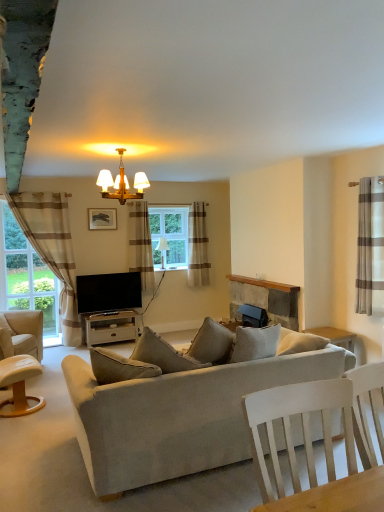
Question: From a real-world perspective, is rustic stone fireplace at center positioned above or below beige fabric couch at center?

Choices:
 (A) below
 (B) above

Answer: (B)

Question: Is rustic stone fireplace at center taller or shorter than beige fabric couch at center?

Choices:
 (A) tall
 (B) short

Answer: (B)

Question: Which is nearer to the clear glass window at center?

Choices:
 (A) matte gold chandelier at upper center, placed as the second lamp when sorted from bottom to top
 (B) rustic stone fireplace at center
 (C) beige striped curtain at left, which is the 4th curtain from right to left
 (D) light brown wooden chair at lower left, arranged as the 1th chair when viewed from the front
 (E) matte white lampshade at center, the 1th lamp positioned from the bottom

Answer: (E)

Question: Based on their relative distances, which object is nearer to the rustic stone fireplace at center?

Choices:
 (A) beige fabric couch at center
 (B) clear glass window at center
 (C) beige fabric chair at left, which is the 1th chair in back-to-front order
 (D) matte gold chandelier at upper center, positioned as the 2th lamp in back-to-front order
 (E) matte black picture frame at upper center

Answer: (B)